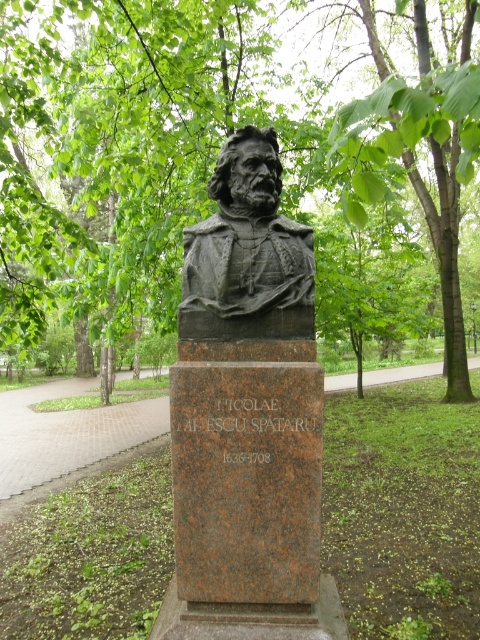
Question: Which point is farther to the camera?

Choices:
 (A) (121, 40)
 (B) (264, 170)

Answer: (A)

Question: Which object appears closest to the camera in this image?

Choices:
 (A) brown granite bust at center
 (B) green leafy tree at upper center
 (C) dark gray stone bust at center

Answer: (A)

Question: Which object appears closest to the camera in this image?

Choices:
 (A) dark gray stone bust at center
 (B) brown granite bust at center

Answer: (B)

Question: Can you confirm if green leafy tree at upper center is positioned above dark gray stone bust at center?

Choices:
 (A) yes
 (B) no

Answer: (A)

Question: Can you confirm if green leafy tree at upper center is smaller than dark gray stone bust at center?

Choices:
 (A) yes
 (B) no

Answer: (A)

Question: Is green leafy tree at upper center to the left of brown granite bust at center from the viewer's perspective?

Choices:
 (A) yes
 (B) no

Answer: (A)